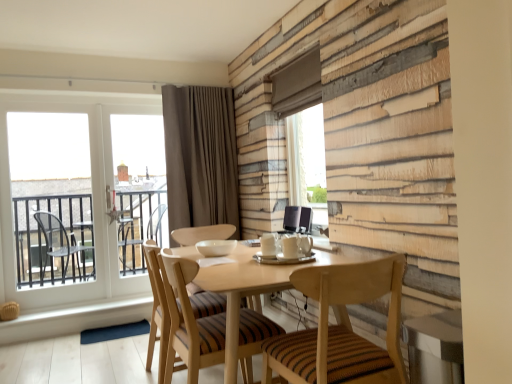
The image size is (512, 384). I want to click on vacant point above transparent glass door at left, which is the first window screen in left-to-right order (from a real-world perspective), so click(x=36, y=101).